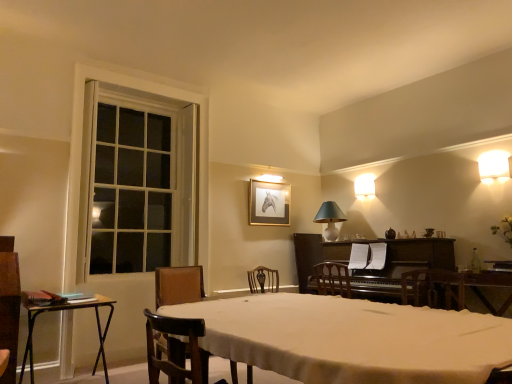
Question: Considering the relative sizes of clear glass bottle at right and dark polished wood piano at center-right in the image provided, is clear glass bottle at right bigger than dark polished wood piano at center-right?

Choices:
 (A) yes
 (B) no

Answer: (B)

Question: Is clear glass bottle at right with dark polished wood piano at center-right?

Choices:
 (A) no
 (B) yes

Answer: (A)

Question: Can you confirm if clear glass bottle at right is thinner than dark polished wood piano at center-right?

Choices:
 (A) yes
 (B) no

Answer: (A)

Question: From the image's perspective, is clear glass bottle at right located above dark polished wood piano at center-right?

Choices:
 (A) no
 (B) yes

Answer: (B)

Question: Is clear glass bottle at right closer to camera compared to dark polished wood piano at center-right?

Choices:
 (A) yes
 (B) no

Answer: (B)

Question: From the image's perspective, is clear glass bottle at right located beneath dark polished wood piano at center-right?

Choices:
 (A) no
 (B) yes

Answer: (A)

Question: Is white ceramic lampshade at upper center, which appears as the second lamp when viewed from the front, facing away from wooden table at center?

Choices:
 (A) no
 (B) yes

Answer: (A)

Question: Is white ceramic lampshade at upper center, which appears as the 1th lamp when ordered from the bottom, outside of wooden table at center?

Choices:
 (A) no
 (B) yes

Answer: (B)

Question: Does white ceramic lampshade at upper center, which appears as the 1th lamp when ordered from the bottom, have a greater width compared to wooden table at center?

Choices:
 (A) yes
 (B) no

Answer: (B)

Question: Is the depth of white ceramic lampshade at upper center, the 1th lamp when ordered from left to right, greater than that of wooden table at center?

Choices:
 (A) yes
 (B) no

Answer: (A)

Question: From a real-world perspective, is white ceramic lampshade at upper center, acting as the third lamp starting from the right, on wooden table at center?

Choices:
 (A) yes
 (B) no

Answer: (A)

Question: From the image's perspective, does white ceramic lampshade at upper center, which is the third lamp from top to bottom, appear lower than wooden table at center?

Choices:
 (A) no
 (B) yes

Answer: (A)

Question: Is wooden table at center wider than white ceramic lampshade at upper center, which appears as the 1th lamp when ordered from the bottom?

Choices:
 (A) no
 (B) yes

Answer: (B)